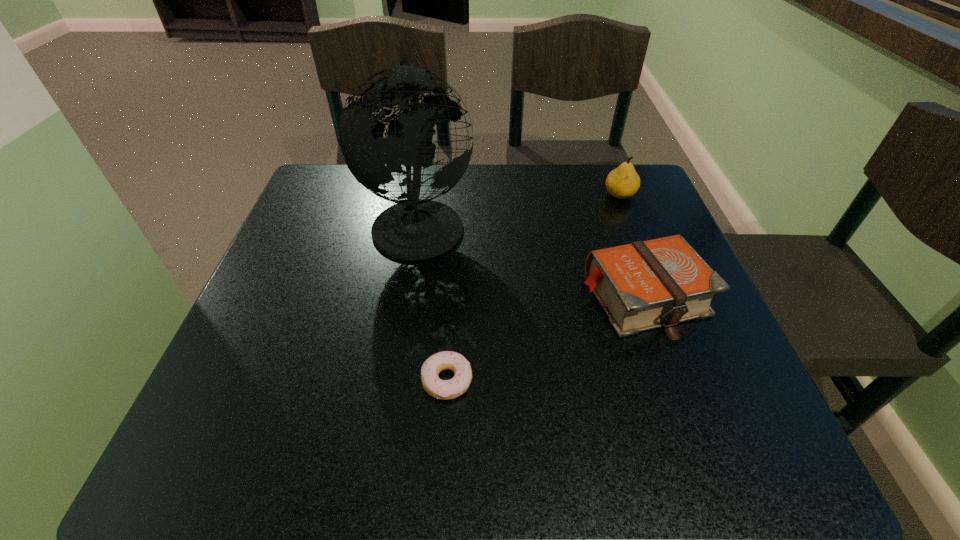
The width and height of the screenshot is (960, 540). What are the coordinates of `vacant space in between the tallest object and the Bible` in the screenshot? It's located at pyautogui.click(x=532, y=259).

What are the coordinates of `empty space that is in between the pear and the tallest object` in the screenshot? It's located at (519, 209).

Locate an element on the screen. vacant space that's between the doughnut and the Bible is located at coordinates (545, 339).

You are a GUI agent. You are given a task and a screenshot of the screen. Output one action in this format:
    pyautogui.click(x=<x>, y=<y>)
    Task: Click on the free space that is in between the nearest object and the tallest object
    
    Given the screenshot: What is the action you would take?
    pyautogui.click(x=433, y=301)

Find the location of a particular element. This screenshot has width=960, height=540. free spot between the pear and the doughnut is located at coordinates (534, 288).

This screenshot has height=540, width=960. Find the location of `empty space between the third shortest object and the shortest object`. empty space between the third shortest object and the shortest object is located at coordinates (534, 288).

This screenshot has width=960, height=540. Identify the location of vacant area between the doughnut and the globe. (433, 301).

The width and height of the screenshot is (960, 540). Find the location of `vacant point located between the shortest object and the second tallest object`. vacant point located between the shortest object and the second tallest object is located at coordinates (534, 288).

The height and width of the screenshot is (540, 960). In order to click on the second closest object to the tallest object in this screenshot , I will do `click(449, 389)`.

Find the location of a particular element. The height and width of the screenshot is (540, 960). object that is the third closest one to the pear is located at coordinates (449, 389).